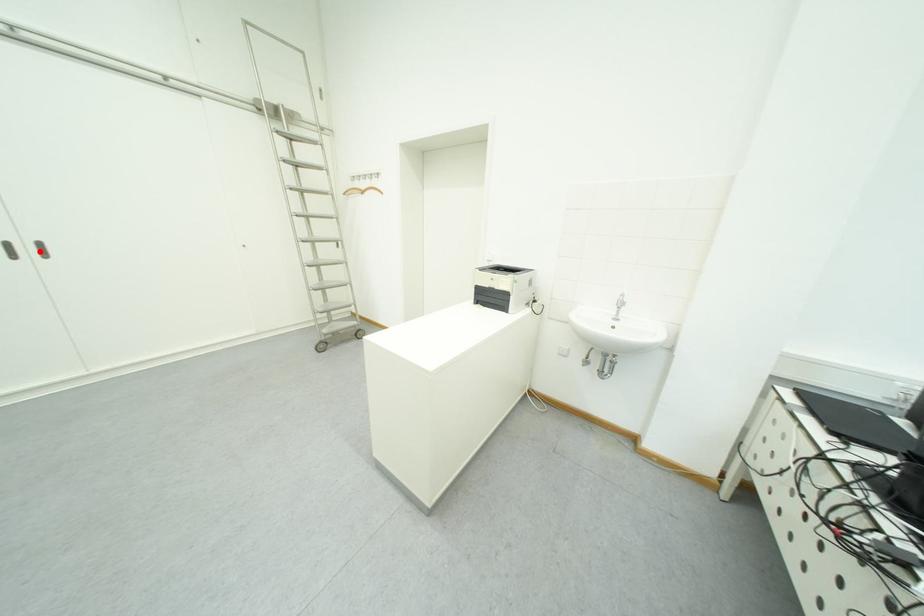
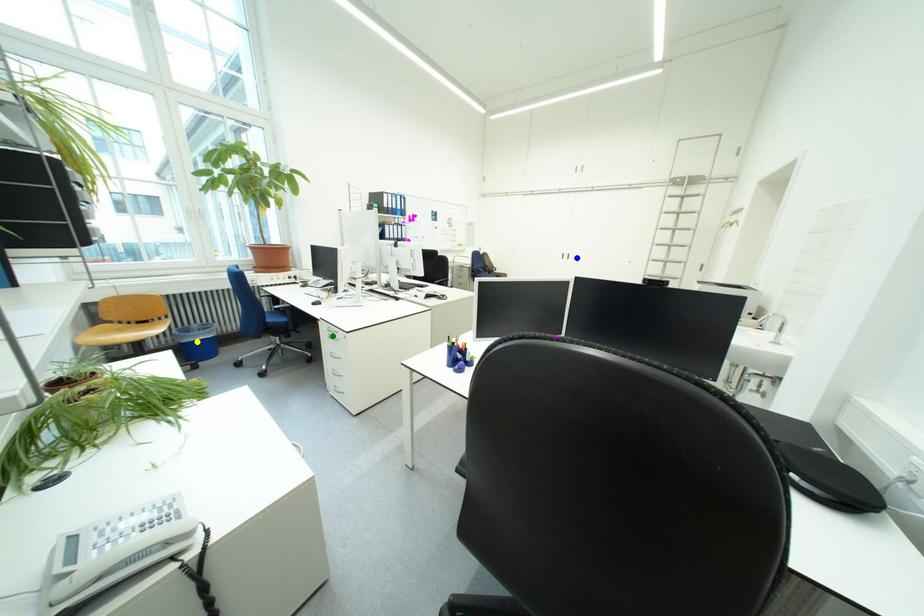
Question: I am providing you with two images of the same scene from different viewpoints. A red point is marked on the first image. You are given multiple points on the second image. Which mark in image 2 goes with the point in image 1?

Choices:
 (A) blue point
 (B) green point
 (C) yellow point

Answer: (A)